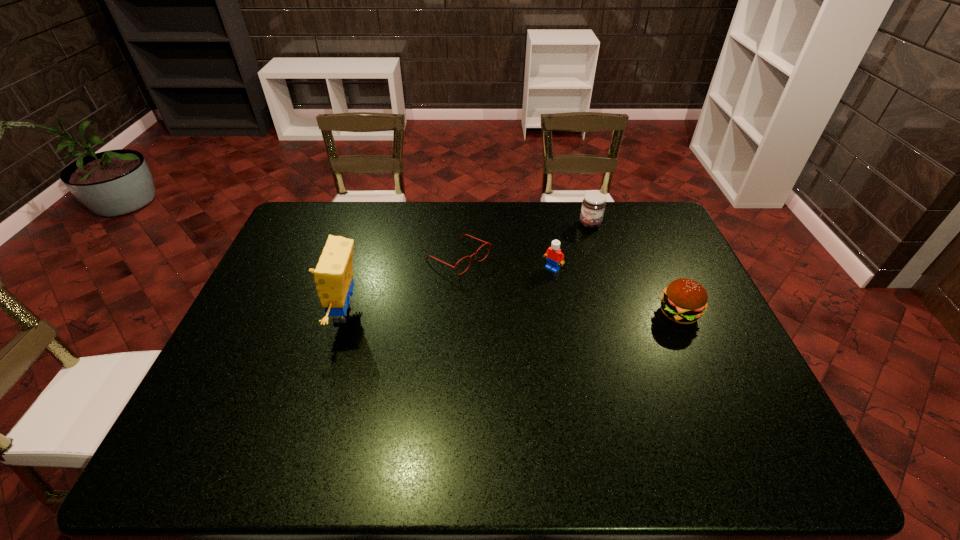
Locate an element on the screen. The width and height of the screenshot is (960, 540). the leftmost object is located at coordinates (333, 276).

This screenshot has width=960, height=540. I want to click on the tallest object, so click(333, 276).

Image resolution: width=960 pixels, height=540 pixels. Identify the location of hamburger. (684, 301).

Locate an element on the screen. the second object from left to right is located at coordinates (489, 244).

Find the location of a particular element. spectacles is located at coordinates (489, 244).

This screenshot has width=960, height=540. Identify the location of jam. (593, 205).

Find the location of a particular element. This screenshot has height=540, width=960. the fourth object from left to right is located at coordinates (593, 205).

Where is `Lego`? The image size is (960, 540). Lego is located at coordinates (555, 257).

The height and width of the screenshot is (540, 960). Find the location of `free spot located on the face of the leftmost object`. free spot located on the face of the leftmost object is located at coordinates (257, 314).

Where is `vacant space situated 0.130m on the face of the leftmost object`? The width and height of the screenshot is (960, 540). vacant space situated 0.130m on the face of the leftmost object is located at coordinates (278, 314).